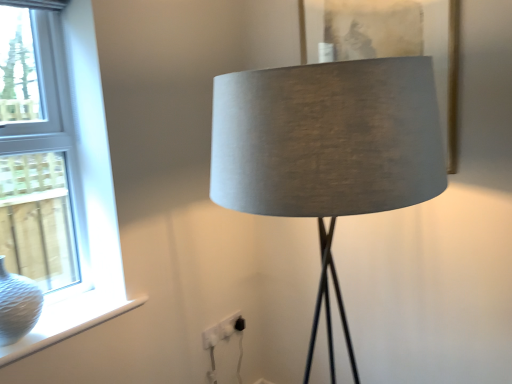
Question: Considering the relative positions of white textured glass vase at left and matte gray fabric picture frame at center in the image provided, is white textured glass vase at left in front of matte gray fabric picture frame at center?

Choices:
 (A) yes
 (B) no

Answer: (A)

Question: Is matte gray fabric picture frame at center a part of white textured glass vase at left?

Choices:
 (A) yes
 (B) no

Answer: (B)

Question: Is white textured glass vase at left taller than matte gray fabric picture frame at center?

Choices:
 (A) yes
 (B) no

Answer: (B)

Question: Can you confirm if white textured glass vase at left is wider than matte gray fabric picture frame at center?

Choices:
 (A) no
 (B) yes

Answer: (B)

Question: Does white textured glass vase at left have a lesser width compared to matte gray fabric picture frame at center?

Choices:
 (A) no
 (B) yes

Answer: (A)

Question: From a real-world perspective, does white textured glass vase at left sit lower than matte gray fabric picture frame at center?

Choices:
 (A) yes
 (B) no

Answer: (A)

Question: Does white glass window at left have a larger size compared to white textured vase at lower left?

Choices:
 (A) no
 (B) yes

Answer: (B)

Question: Is white glass window at left smaller than white textured vase at lower left?

Choices:
 (A) yes
 (B) no

Answer: (B)

Question: Can you see white glass window at left touching white textured vase at lower left?

Choices:
 (A) yes
 (B) no

Answer: (B)

Question: Is white glass window at left closer to camera compared to white textured vase at lower left?

Choices:
 (A) no
 (B) yes

Answer: (B)

Question: Is white glass window at left at the left side of white textured vase at lower left?

Choices:
 (A) no
 (B) yes

Answer: (B)

Question: From the image's perspective, is white glass window at left above white textured vase at lower left?

Choices:
 (A) yes
 (B) no

Answer: (A)

Question: Is white glass window at left positioned far away from satin grey lampshade at center?

Choices:
 (A) yes
 (B) no

Answer: (B)